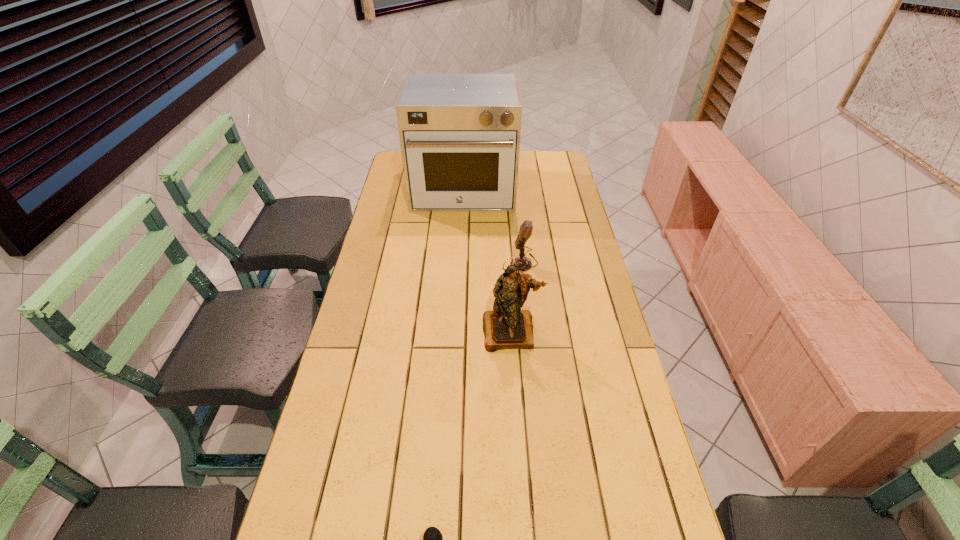
At what (x,y) coordinates should I click in order to perform the action: click on the tallest object. Please return your answer as a coordinate pair (x, y). The image size is (960, 540). Looking at the image, I should click on (459, 134).

The image size is (960, 540). What are the coordinates of `the farthest object` in the screenshot? It's located at (459, 134).

This screenshot has height=540, width=960. In order to click on figurine in this screenshot , I will do `click(506, 327)`.

You are a GUI agent. You are given a task and a screenshot of the screen. Output one action in this format:
    pyautogui.click(x=<x>, y=<y>)
    Task: Click on the second tallest object
    This screenshot has width=960, height=540.
    Given the screenshot: What is the action you would take?
    pyautogui.click(x=506, y=327)

Find the location of a particular element. the taller microphone is located at coordinates (521, 263).

Where is `the right microphone`? the right microphone is located at coordinates (521, 263).

Where is `vacant region located 0.340m on the front panel of the tallest object`? Image resolution: width=960 pixels, height=540 pixels. vacant region located 0.340m on the front panel of the tallest object is located at coordinates (459, 272).

Where is `free space located on the front-facing side of the second tallest object`? Image resolution: width=960 pixels, height=540 pixels. free space located on the front-facing side of the second tallest object is located at coordinates (516, 395).

Where is `free space located 0.210m on the front-facing side of the right microphone`? This screenshot has height=540, width=960. free space located 0.210m on the front-facing side of the right microphone is located at coordinates (450, 262).

This screenshot has width=960, height=540. What are the coordinates of `free space located 0.200m on the front-facing side of the right microphone` in the screenshot? It's located at (453, 262).